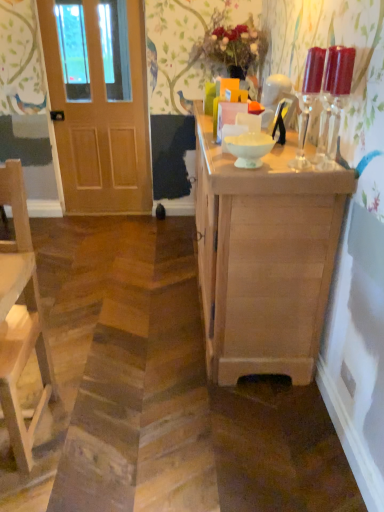
Question: In the image, is wooden door at left positioned in front of or behind natural wood cabinet at center?

Choices:
 (A) behind
 (B) front

Answer: (A)

Question: Looking at their shapes, would you say wooden door at left is wider or thinner than natural wood cabinet at center?

Choices:
 (A) thin
 (B) wide

Answer: (A)

Question: Considering the real-world distances, which object is farthest from the light brown wooden chair at left?

Choices:
 (A) clear glass candle holders at upper right, the 2th candle holder viewed from the right
 (B) white glossy bowl at center
 (C) wooden door at left
 (D) natural wood cabinet at center
 (E) translucent glass candle holders at upper right, acting as the second candle holder starting from the left

Answer: (C)

Question: Based on their relative distances, which object is nearer to the white glossy bowl at center?

Choices:
 (A) natural wood cabinet at center
 (B) clear glass candle holders at upper right, the 2th candle holder viewed from the right
 (C) translucent glass candle holders at upper right, acting as the second candle holder starting from the left
 (D) light brown wooden chair at left
 (E) wooden door at left

Answer: (B)